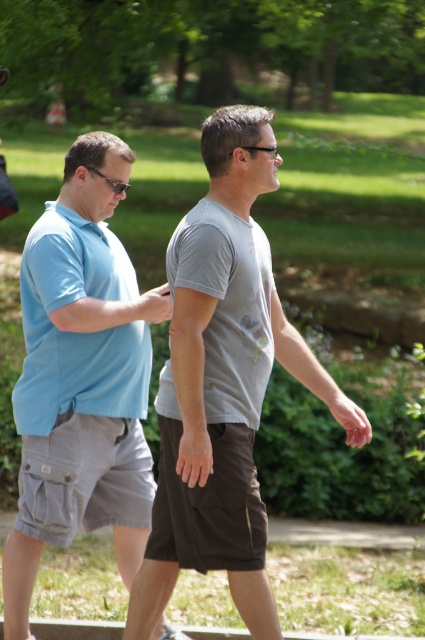
Question: Which object appears closest to the camera in this image?

Choices:
 (A) gray cotton t-shirt at center
 (B) black plastic sunglasses at left
 (C) black plastic glasses at center
 (D) gray matte t-shirt at center

Answer: (A)

Question: Is gray matte t-shirt at center below black plastic sunglasses at left?

Choices:
 (A) yes
 (B) no

Answer: (A)

Question: Which is nearer to the gray matte t-shirt at center?

Choices:
 (A) gray cotton t-shirt at center
 (B) matte blue shirt at left
 (C) black plastic sunglasses at left

Answer: (A)

Question: Does matte blue polo shirt at left have a greater width compared to gray matte t-shirt at center?

Choices:
 (A) yes
 (B) no

Answer: (A)

Question: Which point is farther to the camera?

Choices:
 (A) (204, 444)
 (B) (90, 339)

Answer: (B)

Question: Is matte blue polo shirt at left thinner than black plastic sunglasses at left?

Choices:
 (A) yes
 (B) no

Answer: (B)